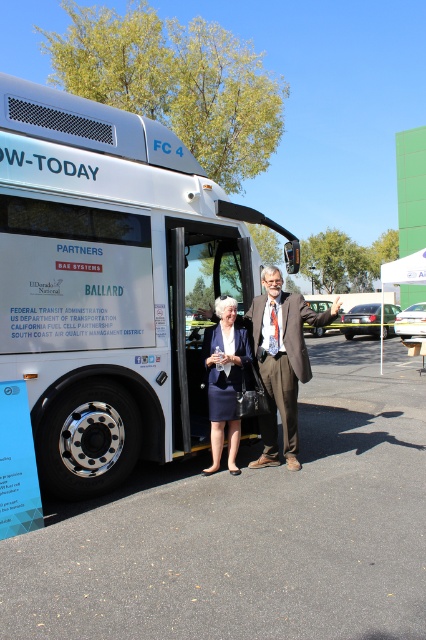
You are a photographer positioned at the front of the scene. You want to capture a photo of the navy blue skirt at center and the white plastic bus stop at center without any obstructions. Based on their positions, which object should you focus on first to ensure both are in frame?

The navy blue skirt at center is closer to the viewer than the white plastic bus stop at center. To ensure both are in frame without obstructions, focus on the navy blue skirt at center first, as it is nearer and will help position the bus stop behind it appropriately.

You are a photographer at the event and need to capture a photo of both the brown textured suit at center and the navy blue skirt at center. Which object should you focus on first to ensure it appears larger in the photo?

The brown textured suit at center is much taller than the navy blue skirt at center, so focusing on it first will ensure it appears larger in the photo.